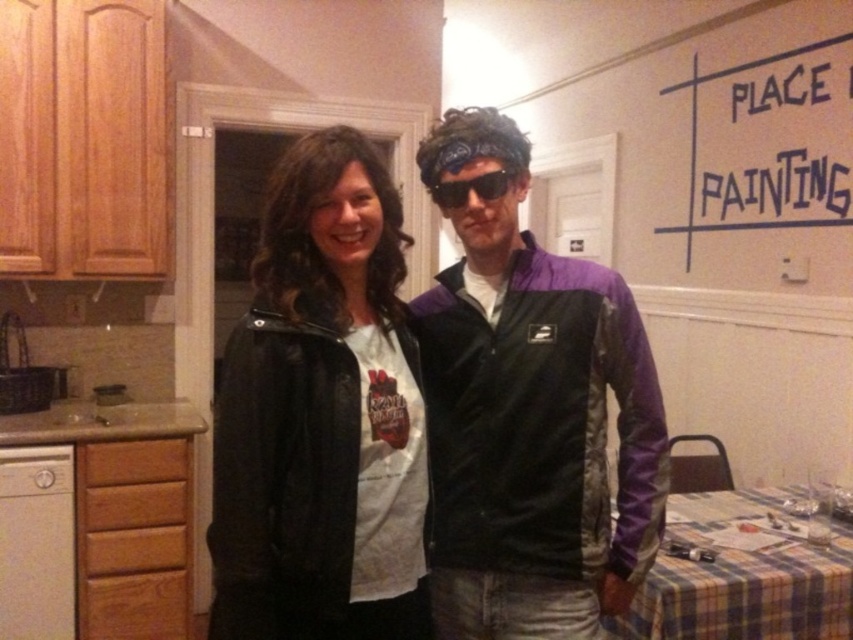
Question: Is purple/black jacket at center above sunglasses at center?

Choices:
 (A) yes
 (B) no

Answer: (B)

Question: Where is purple/black jacket at center located in relation to sunglasses at center in the image?

Choices:
 (A) above
 (B) below

Answer: (B)

Question: Which point is farther to the camera?

Choices:
 (A) sunglasses at center
 (B) matte black jacket at center
 (C) purple/black jacket at center

Answer: (A)

Question: Which point appears closest to the camera in this image?

Choices:
 (A) (445, 196)
 (B) (401, 264)

Answer: (A)

Question: Is purple/black jacket at center to the right of matte black jacket at center from the viewer's perspective?

Choices:
 (A) yes
 (B) no

Answer: (A)

Question: Which object is positioned farthest from the sunglasses at center?

Choices:
 (A) purple/black jacket at center
 (B) matte black jacket at center

Answer: (A)